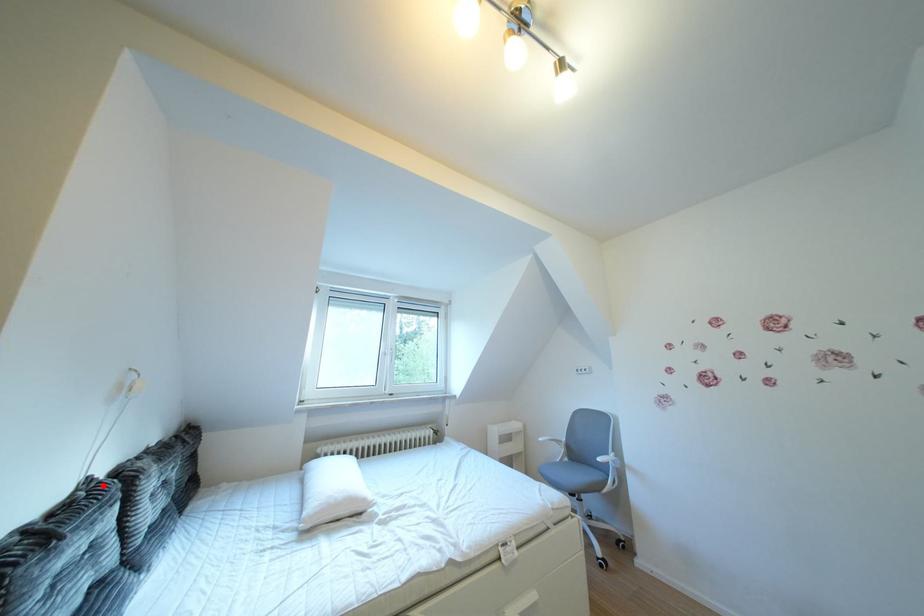
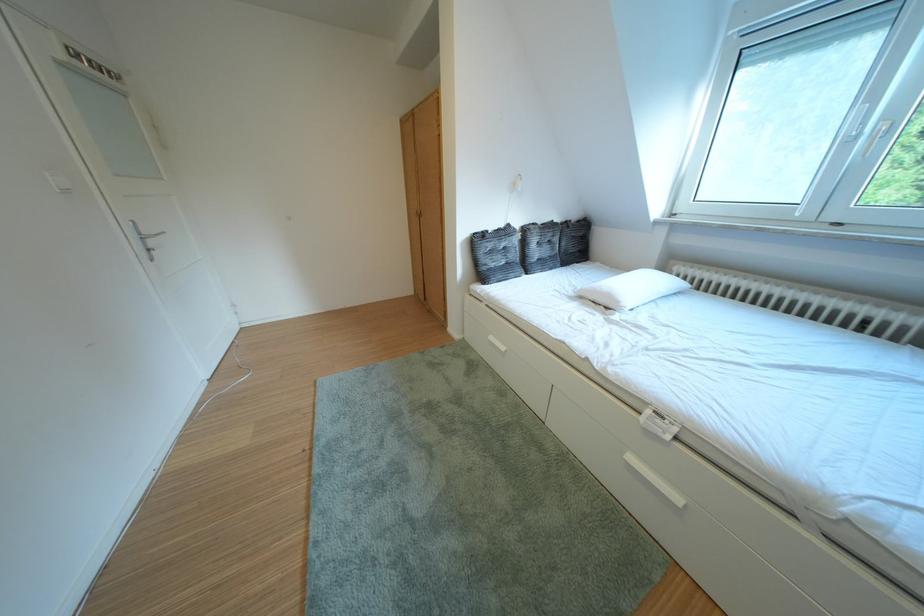
Find the pixel in the second image that matches the highlighted location in the first image.

(523, 230)